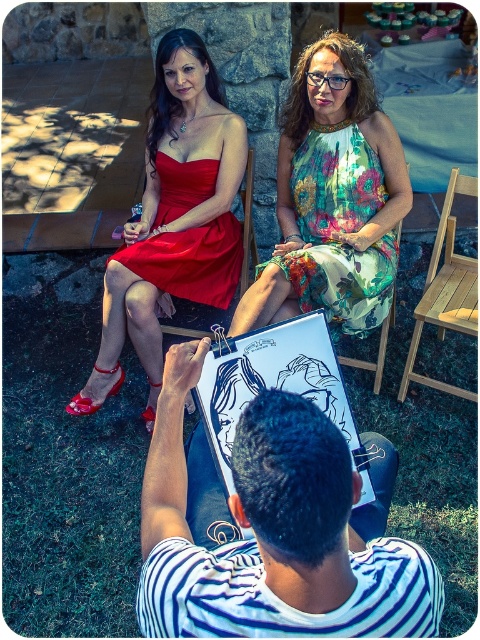
Question: Does matte satin dress at upper left have a smaller size compared to wooden chair at center?

Choices:
 (A) yes
 (B) no

Answer: (B)

Question: Is matte satin dress at upper left to the right of floral printed dress at upper center from the viewer's perspective?

Choices:
 (A) no
 (B) yes

Answer: (A)

Question: Among these objects, which one is farthest from the camera?

Choices:
 (A) matte satin dress at upper left
 (B) wooden chair at center
 (C) floral printed dress at upper center

Answer: (A)

Question: Observing the image, what is the correct spatial positioning of matte satin dress at upper left in reference to matte red dress at upper left?

Choices:
 (A) above
 (B) below

Answer: (B)

Question: Which point is farther to the camera?

Choices:
 (A) (469, 259)
 (B) (146, 250)
 (C) (358, 291)

Answer: (A)

Question: Considering the real-world distances, which object is farthest from the floral printed dress at upper center?

Choices:
 (A) striped cotton shirt at center
 (B) matte satin dress at upper left
 (C) matte red dress at upper left

Answer: (A)